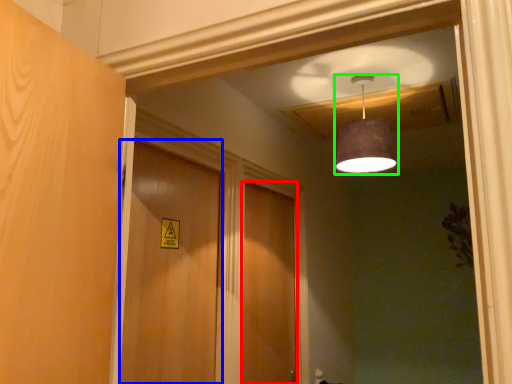
Question: Which object is the farthest from door (highlighted by a red box)? Choose among these: door (highlighted by a blue box) or lamp (highlighted by a green box).

Choices:
 (A) door
 (B) lamp

Answer: (B)